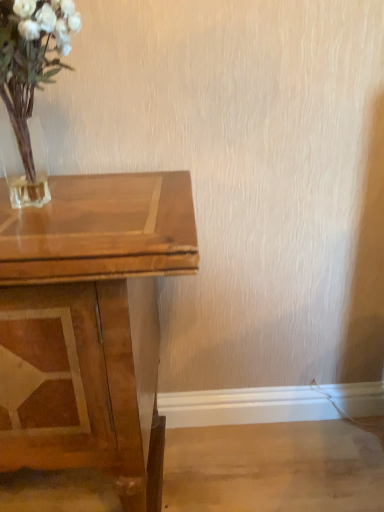
I want to click on vacant region to the right of translucent glass vase at upper left, so 139,202.